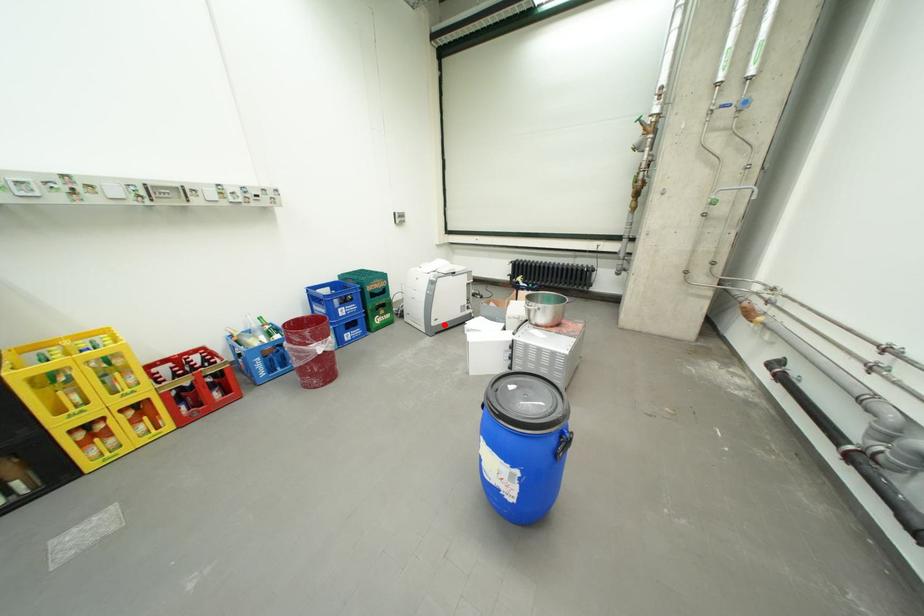
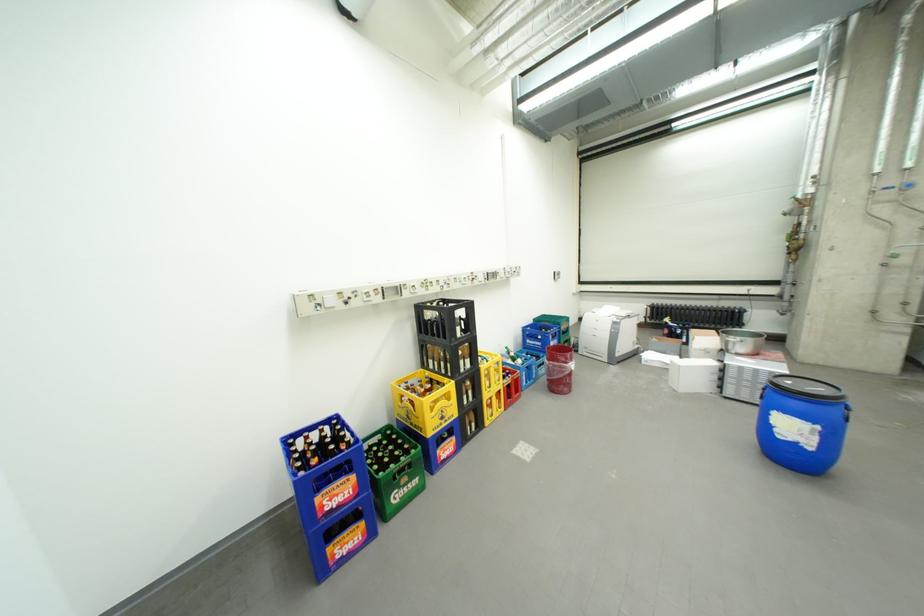
Where in the second image is the point corresponding to the highlighted location from the first image?

(627, 355)